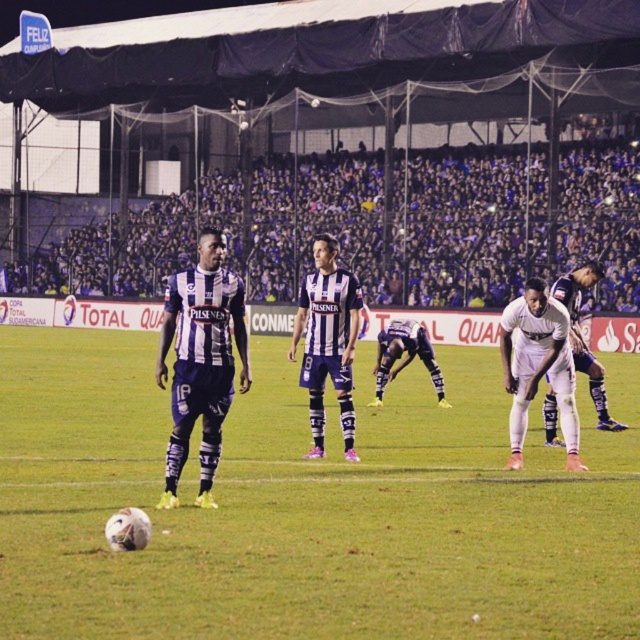
Is striped jersey player at center closer to the viewer compared to white matte uniform at center?

Yes, it is.

Does striped jersey player at center appear on the left side of white matte uniform at center?

Correct, you'll find striped jersey player at center to the left of white matte uniform at center.

Who is more forward, [211,497] or [541,369]?

Positioned in front is point [211,497].

Find the location of a particular element. striped jersey player at center is located at coordinates (200, 360).

Is purple striped jersey at center to the left of dark blue jersey at center from the viewer's perspective?

Correct, you'll find purple striped jersey at center to the left of dark blue jersey at center.

Is purple striped jersey at center thinner than dark blue jersey at center?

Correct, purple striped jersey at center's width is less than dark blue jersey at center's.

What do you see at coordinates (326, 340) in the screenshot? I see `purple striped jersey at center` at bounding box center [326, 340].

This screenshot has width=640, height=640. Find the location of `purple striped jersey at center`. purple striped jersey at center is located at coordinates (326, 340).

Is point (220, 410) positioned behind point (595, 268)?

No, (220, 410) is closer to viewer.

Who is positioned more to the left, striped jersey player at center or white matte soccer player at center?

From the viewer's perspective, striped jersey player at center appears more on the left side.

The height and width of the screenshot is (640, 640). What do you see at coordinates (200, 360) in the screenshot?
I see `striped jersey player at center` at bounding box center [200, 360].

Identify the location of striped jersey player at center. (200, 360).